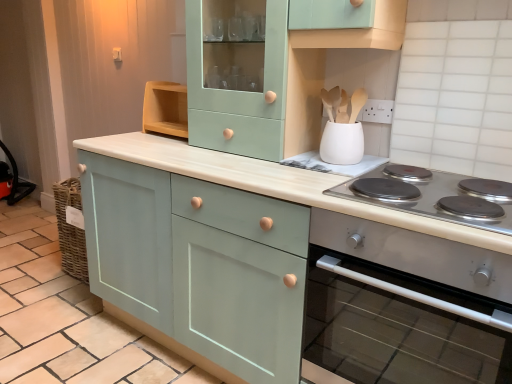
Where is `vacant area that lies in front of mint green wood cabinet at upper center, which appears as the second cabinetry when viewed from the right`? The image size is (512, 384). vacant area that lies in front of mint green wood cabinet at upper center, which appears as the second cabinetry when viewed from the right is located at coordinates (251, 169).